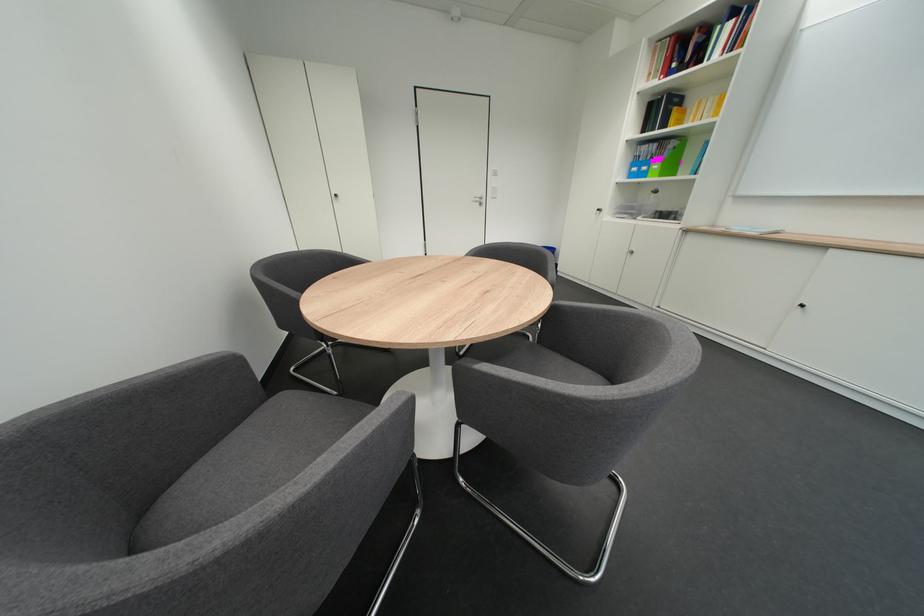
Where is `silver door handle`? Image resolution: width=924 pixels, height=616 pixels. silver door handle is located at coordinates (478, 199).